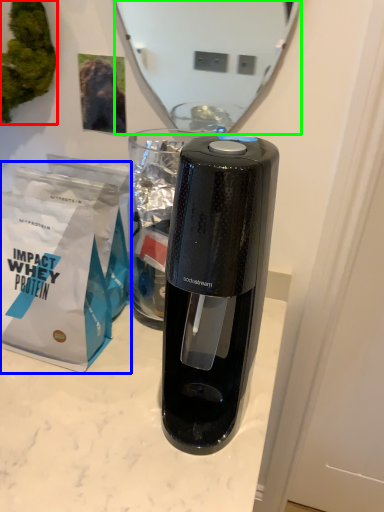
Question: Estimate the real-world distances between objects in this image. Which object is closer to plant (highlighted by a red box), paper bag (highlighted by a blue box) or mirror (highlighted by a green box)?

Choices:
 (A) paper bag
 (B) mirror

Answer: (A)